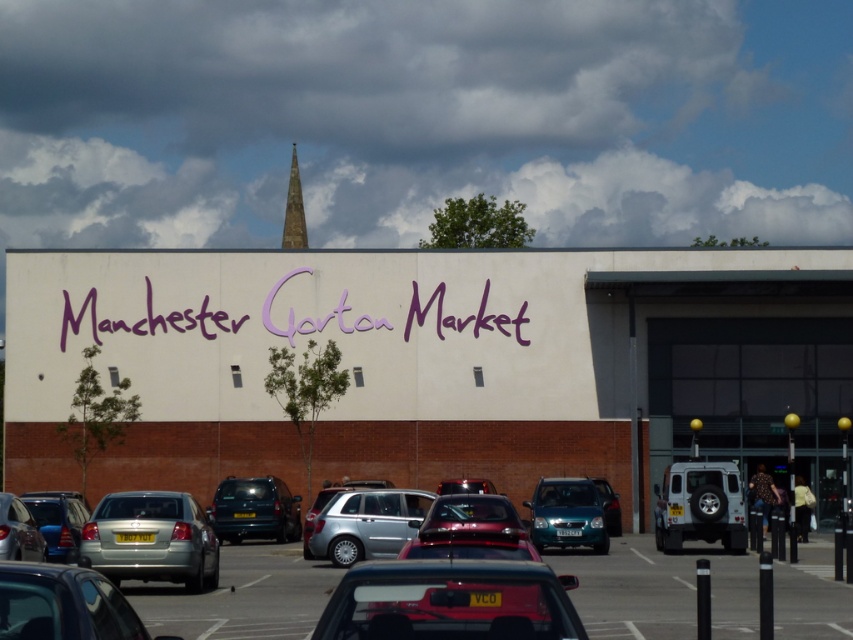
You are standing in front of Manchester Gorton Market and want to take a photo of the market entrance. There are two points marked in the image, point 1 at coordinates (714, 476) and point 2 at coordinates (288, 180). Which point should you focus on to ensure the market entrance is sharply in focus?

You should focus on point 1 at coordinates (714, 476) because it is closer to the camera, ensuring the market entrance will be in focus.

You are standing at the entrance of Manchester Gorton Market and want to take a photo of the smooth gold spire at upper center without any vehicles blocking it. Which vehicle, the silver metallic suv at lower right or another car, is directly in front of the spire that you need to move?

The silver metallic suv at lower right is directly in front of the smooth gold spire at upper center, so you need to move it to take an unobstructed photo.